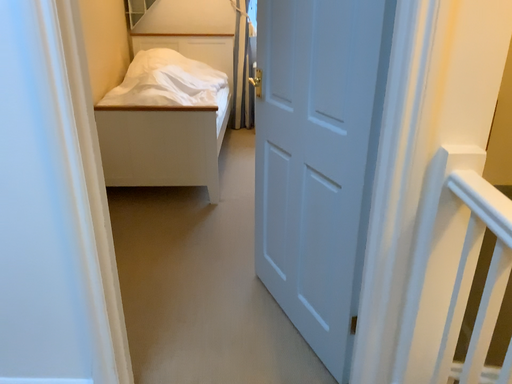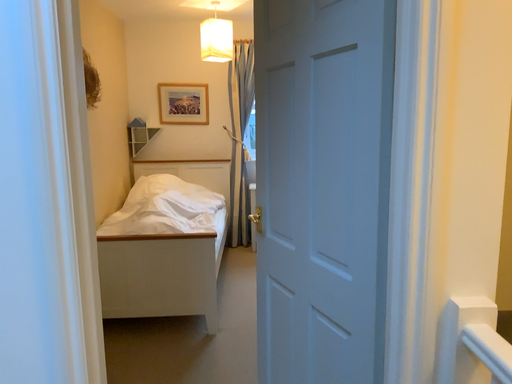
Question: Which way did the camera rotate in the video?

Choices:
 (A) rotated downward
 (B) rotated upward

Answer: (B)